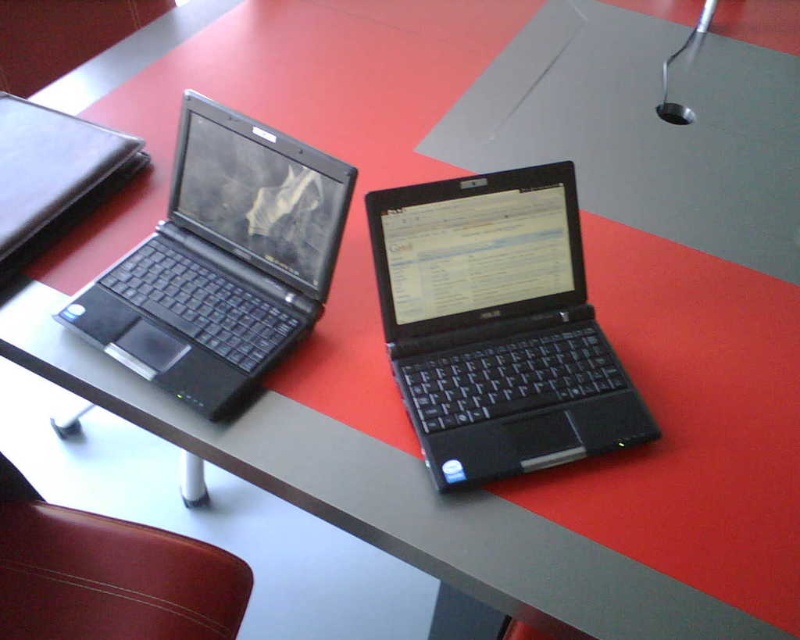
Locate an element on the screen. Image resolution: width=800 pixels, height=640 pixels. matte black laptop at left is located at coordinates (222, 260).

Which of these two, matte black laptop at left or leather at lower left, stands taller?

With more height is matte black laptop at left.

Is point (236, 252) farther from viewer compared to point (72, 538)?

That is False.

At what (x,y) coordinates should I click in order to perform the action: click on matte black laptop at left. Please return your answer as a coordinate pair (x, y). The image size is (800, 640). Looking at the image, I should click on (222, 260).

Does black plastic laptop at center appear under matte black laptop at left?

Yes, black plastic laptop at center is below matte black laptop at left.

Is point (460, 358) in front of point (330, 282)?

Yes.

Does point (580, 435) lie behind point (173, 321)?

That is False.

Where is `black plastic laptop at center`? black plastic laptop at center is located at coordinates (498, 324).

Does black plastic laptop at center have a lesser width compared to leather at lower left?

Indeed, black plastic laptop at center has a lesser width compared to leather at lower left.

Which is behind, point (486, 298) or point (70, 570)?

The point (70, 570) is behind.

Between point (478, 243) and point (74, 632), which one is positioned behind?

The point (74, 632) is behind.

This screenshot has height=640, width=800. What are the coordinates of `black plastic laptop at center` in the screenshot? It's located at click(x=498, y=324).